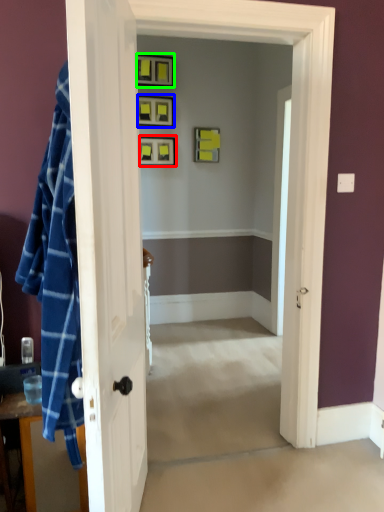
Question: Considering the real-world distances, which object is closest to picture frame (highlighted by a red box)? picture frame (highlighted by a blue box) or picture frame (highlighted by a green box).

Choices:
 (A) picture frame
 (B) picture frame

Answer: (A)